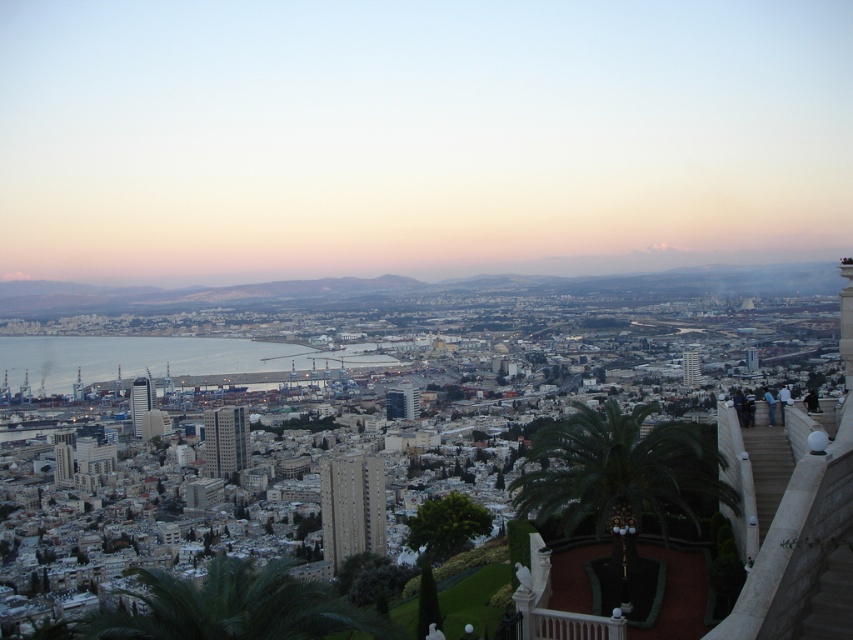
You are standing in the city park and see two green leafy palm trees. One is labeled as green leafy palm at center and the other as green leafy palm tree at lower center. Which one is positioned to the right of the other?

The green leafy palm at center is to the right of the green leafy palm tree at lower center.

You are a city planner reviewing the design of a new park. You notice the green leafy palm at center and the blue water at center. Which object is taller in the proposed design?

The green leafy palm at center is taller than the blue water at center according to the design.

You are standing at the point marked as point (233, 608) in the city panorama. What object is located exactly at that point?

The green leafy palm tree at lower center is located exactly at point (233, 608).